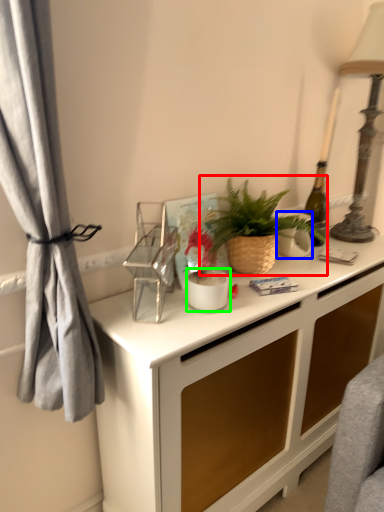
Question: Which object is positioned closest to houseplant (highlighted by a red box)? Select from appliance (highlighted by a blue box) and appliance (highlighted by a green box).

Choices:
 (A) appliance
 (B) appliance

Answer: (A)